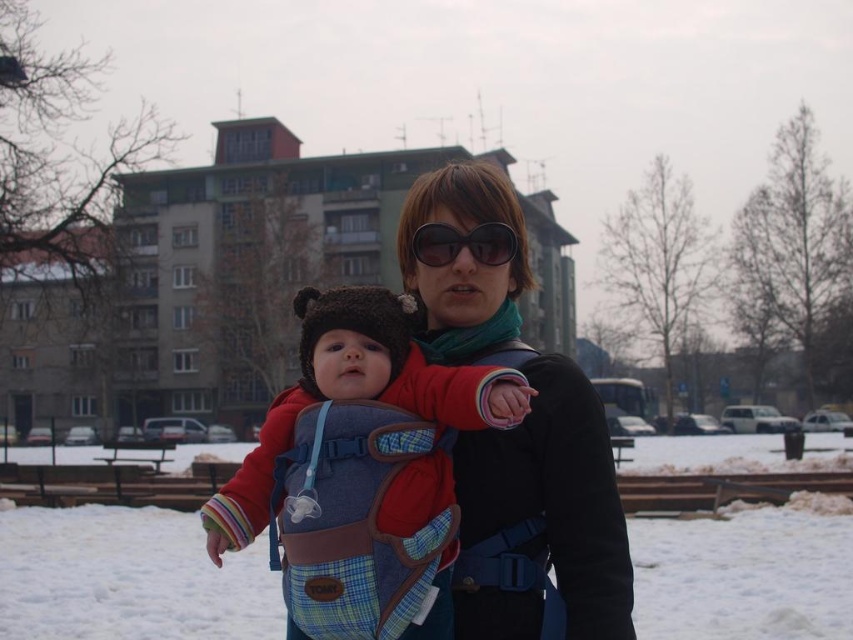
You are a photographer trying to capture a clear shot of the baby in the carrier. Since the white fluffy snow at center and the matte black jacket at center are both in the frame, which object is positioned higher in the image?

The white fluffy snow at center is much taller than the matte black jacket at center, so it is positioned higher in the image.

In the scene shown: You are a photographer taking a picture of the woman and baby in the winter scene. You notice the white fluffy snow at center and the black plastic sunglasses at center. Which object is positioned lower in the image?

The white fluffy snow at center is located below the black plastic sunglasses at center, so the snow is positioned lower in the image.

You are standing in the winter scene and want to place a small snowman exactly at the point labeled as point (x=128, y=579). What will the snowman be placed on?

The point (x=128, y=579) corresponds to white fluffy snow at center, so the snowman will be placed on the white fluffy snow at center.